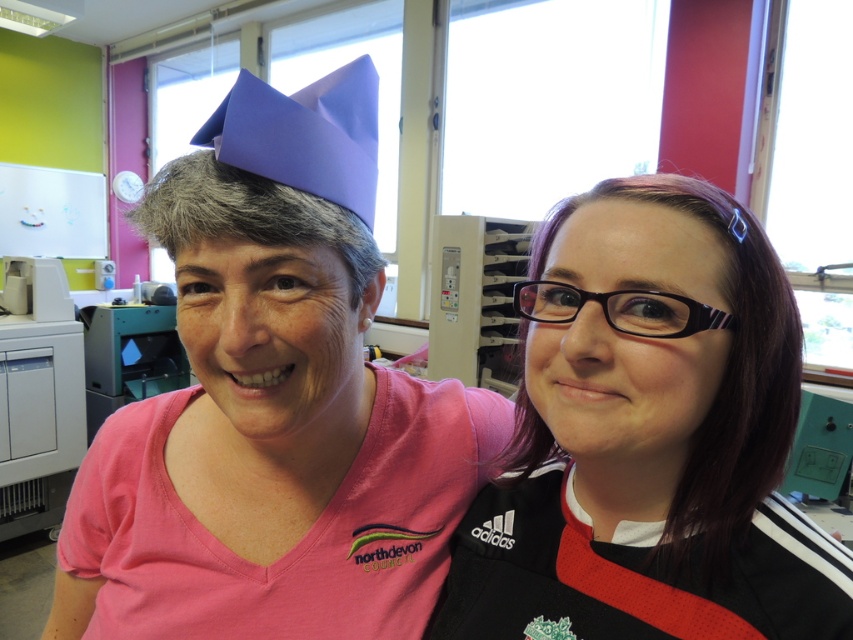
Locate an element on the screen. matte black glasses at upper right is located at coordinates (648, 438).

Locate an element on the screen. Image resolution: width=853 pixels, height=640 pixels. matte black glasses at upper right is located at coordinates (648, 438).

How distant is matte purple paper hat at upper center from purple paper hat at upper center?

matte purple paper hat at upper center is 6.61 inches away from purple paper hat at upper center.

Based on the photo, is matte purple paper hat at upper center below purple paper hat at upper center?

Yes.

Who is more distant from viewer, (x=245, y=584) or (x=216, y=116)?

Positioned behind is point (x=245, y=584).

You are a GUI agent. You are given a task and a screenshot of the screen. Output one action in this format:
    pyautogui.click(x=<x>, y=<y>)
    Task: Click on the matte purple paper hat at upper center
    Image resolution: width=853 pixels, height=640 pixels.
    Given the screenshot: What is the action you would take?
    pyautogui.click(x=274, y=404)

Is matte purple paper hat at upper center shorter than matte black glasses at upper right?

No, matte purple paper hat at upper center is not shorter than matte black glasses at upper right.

Does matte purple paper hat at upper center appear on the right side of matte black glasses at upper right?

Incorrect, matte purple paper hat at upper center is not on the right side of matte black glasses at upper right.

At what (x,y) coordinates should I click in order to perform the action: click on matte purple paper hat at upper center. Please return your answer as a coordinate pair (x, y). Looking at the image, I should click on (274, 404).

The width and height of the screenshot is (853, 640). In order to click on matte purple paper hat at upper center in this screenshot , I will do `click(274, 404)`.